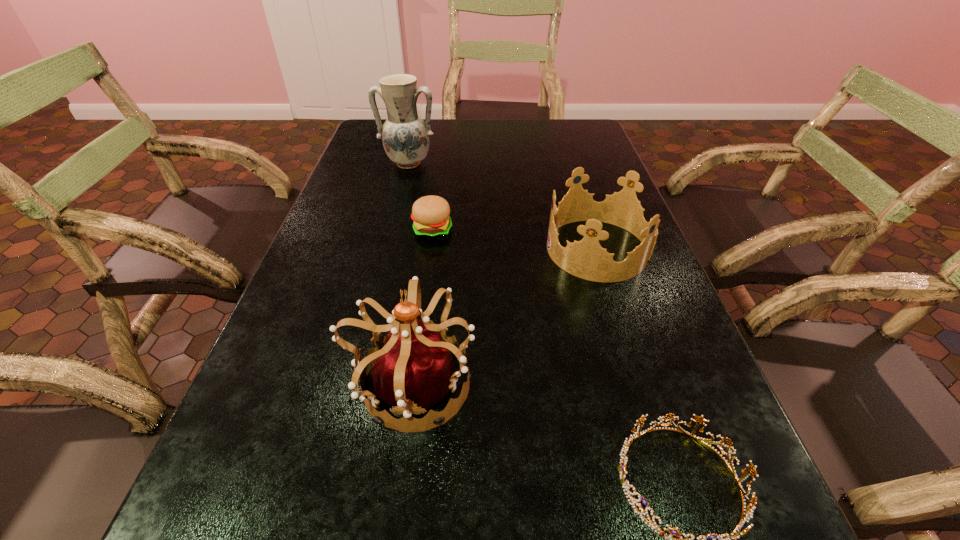
Find the location of a particular element. This screenshot has width=960, height=540. the farthest object is located at coordinates (405, 136).

Image resolution: width=960 pixels, height=540 pixels. In order to click on the leftmost tiara in this screenshot , I will do `click(412, 368)`.

This screenshot has width=960, height=540. I want to click on the farthest tiara, so click(x=586, y=259).

Find the location of a particular element. Image resolution: width=960 pixels, height=540 pixels. the second shortest tiara is located at coordinates (586, 259).

In order to click on hamburger in this screenshot , I will do `click(430, 214)`.

Locate an element on the screen. vacant space positioned on either side of the pottery is located at coordinates pos(391,231).

The image size is (960, 540). What are the coordinates of `vacant position located on the front-facing side of the tallest tiara` in the screenshot? It's located at (620, 384).

Where is `vacant space located 0.280m on the front-facing side of the second tallest tiara`? The width and height of the screenshot is (960, 540). vacant space located 0.280m on the front-facing side of the second tallest tiara is located at coordinates (428, 249).

Identify the location of vacant region located 0.090m on the front-facing side of the second tallest tiara. (509, 249).

Identify the location of vacant space located on the front-facing side of the second tallest tiara. This screenshot has height=540, width=960. (479, 249).